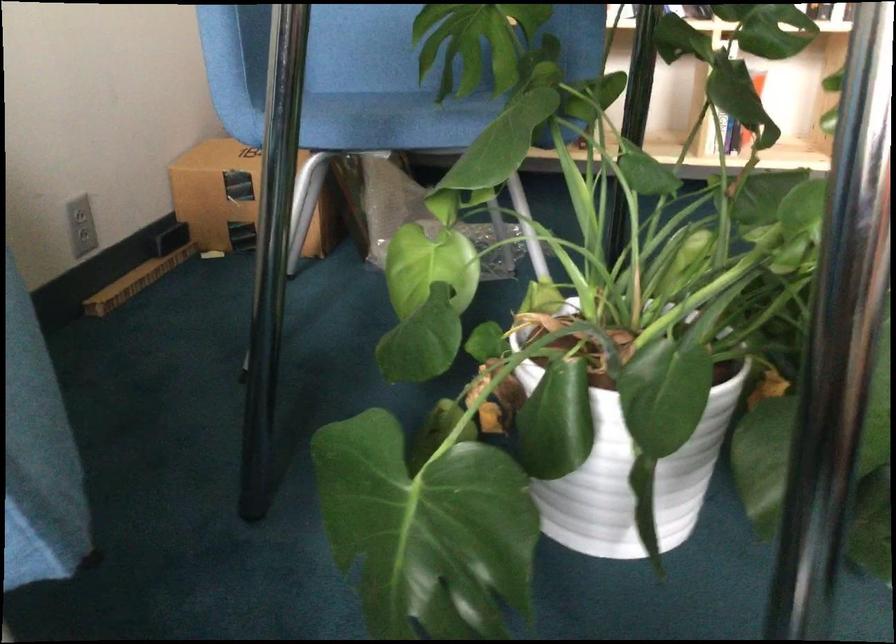
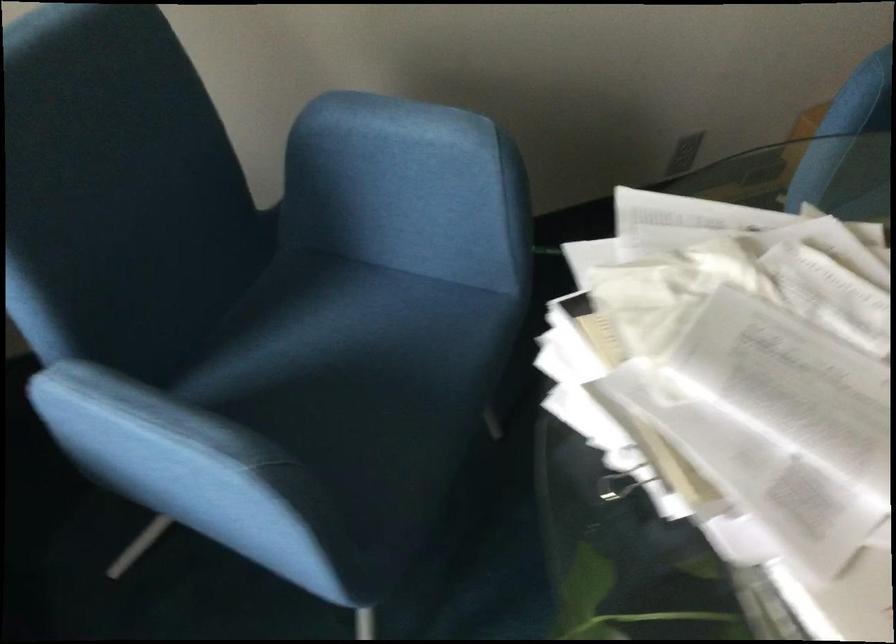
The point at (76, 247) is marked in the first image. Where is the corresponding point in the second image?

(682, 158)